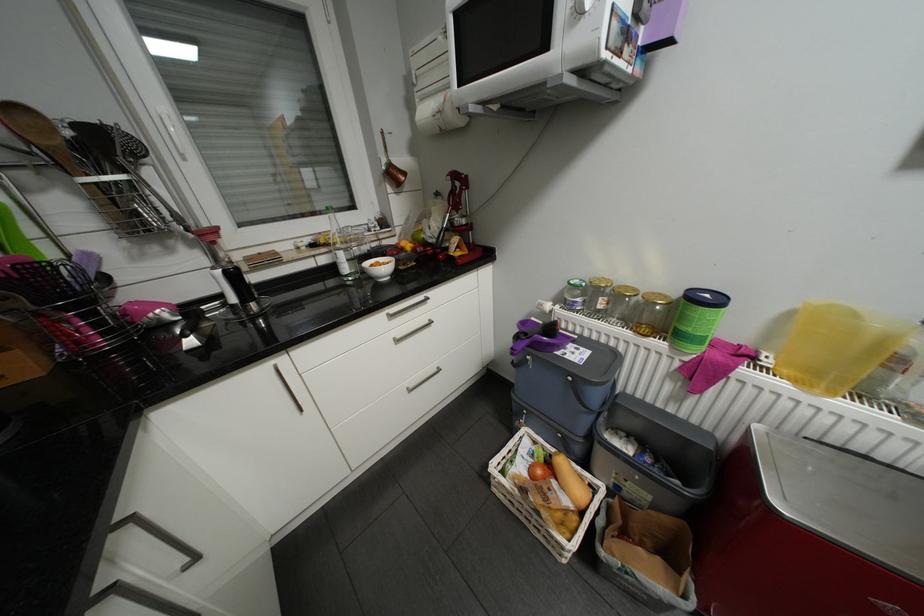
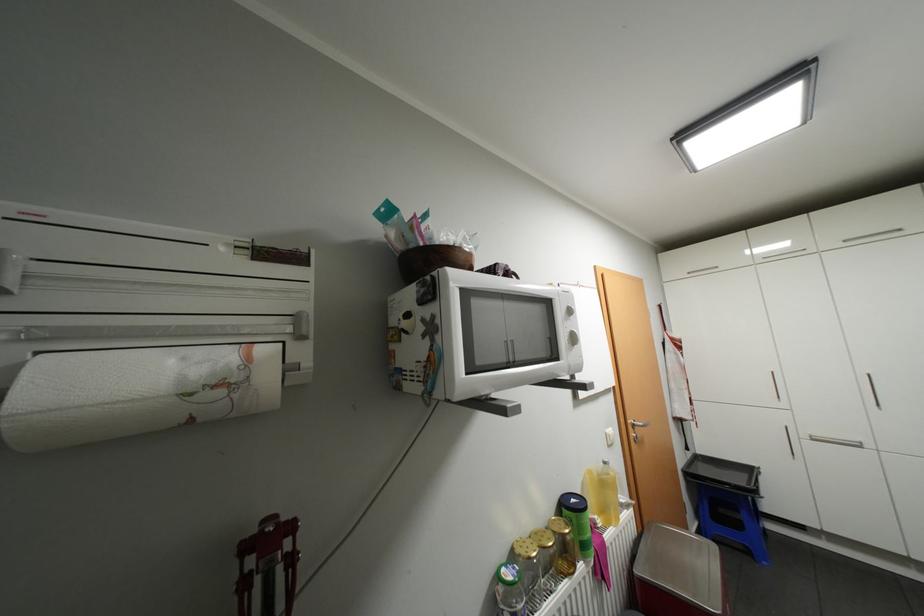
Find the pixel in the second image that matches point 714,294 in the first image.

(580, 499)